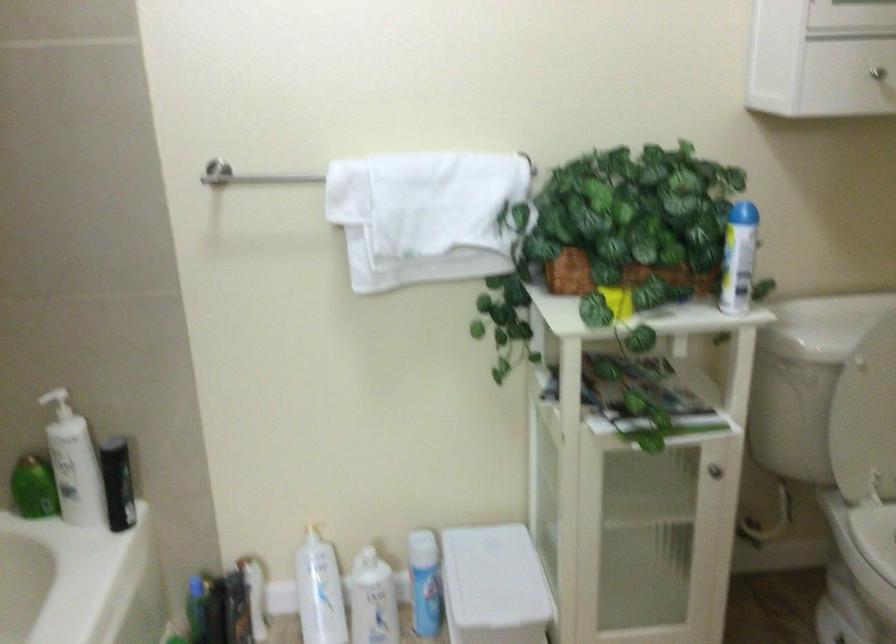
Locate an element on the screen. Image resolution: width=896 pixels, height=644 pixels. white toilet lid is located at coordinates (865, 413).